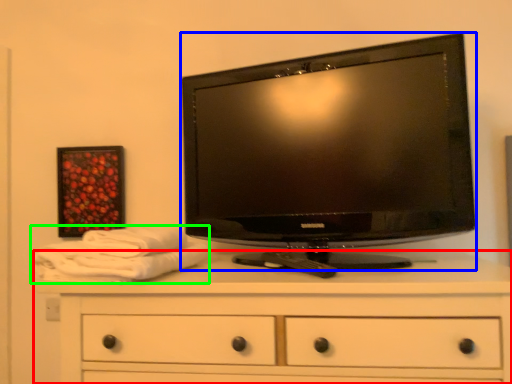
Question: Estimate the real-world distances between objects in this image. Which object is farther from chest of drawers (highlighted by a red box), television (highlighted by a blue box) or bath towel (highlighted by a green box)?

Choices:
 (A) television
 (B) bath towel

Answer: (A)